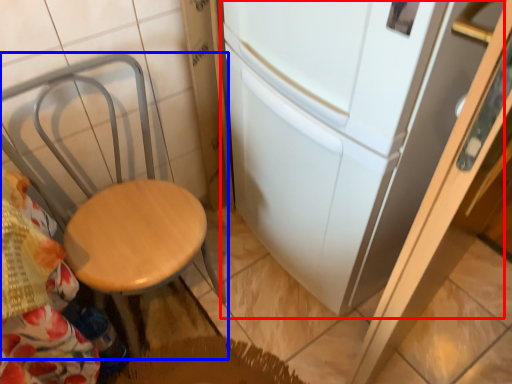
Question: Among these objects, which one is nearest to the camera, fridge (highlighted by a red box) or chair (highlighted by a blue box)?

Choices:
 (A) fridge
 (B) chair

Answer: (A)